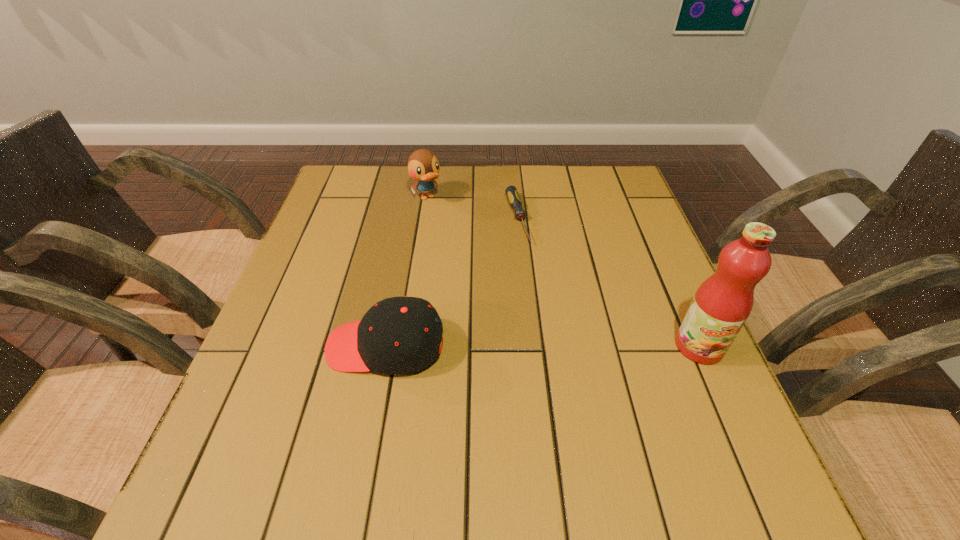
Image resolution: width=960 pixels, height=540 pixels. In order to click on vacant space on the desktop that is between the cap and the fruit juice and is positioned insert the second object from right to left into a screw head in this screenshot , I will do `click(565, 346)`.

What are the coordinates of `free space on the desktop that is between the cap and the rightmost object and is positioned on the front-facing side of the duck` in the screenshot? It's located at (551, 346).